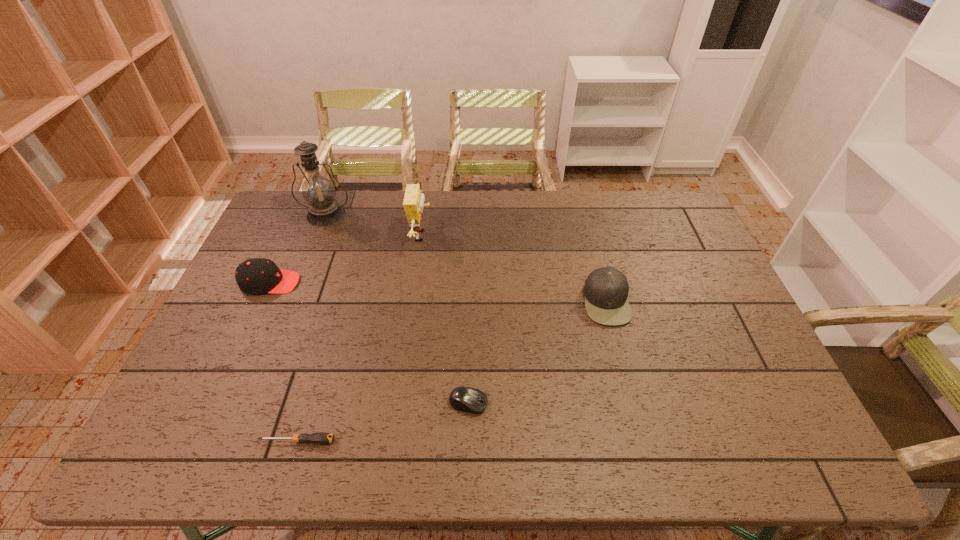
Identify the location of vacant space located 0.390m on the face of the second tallest object. (545, 236).

The height and width of the screenshot is (540, 960). I want to click on vacant space positioned on the brim of the right cap, so click(470, 301).

Image resolution: width=960 pixels, height=540 pixels. I want to click on free location located on the brim of the right cap, so click(514, 301).

Locate an element on the screen. vacant space located on the brim of the right cap is located at coordinates (514, 301).

Identify the location of vacant space located 0.220m on the front-facing side of the left cap. (370, 282).

Locate an element on the screen. Image resolution: width=960 pixels, height=540 pixels. blank area located on the left of the fifth object from left to right is located at coordinates click(417, 403).

The image size is (960, 540). I want to click on vacant space located 0.350m on the right of the shortest object, so click(x=487, y=441).

This screenshot has height=540, width=960. I want to click on oil lamp located at the far edge, so click(318, 191).

You are a GUI agent. You are given a task and a screenshot of the screen. Output one action in this format:
    pyautogui.click(x=<x>, y=<y>)
    Task: Click on the sponge located in the far edge section of the desktop
    This screenshot has width=960, height=540.
    Given the screenshot: What is the action you would take?
    pyautogui.click(x=413, y=203)

Identify the location of object that is at the near edge. (321, 438).